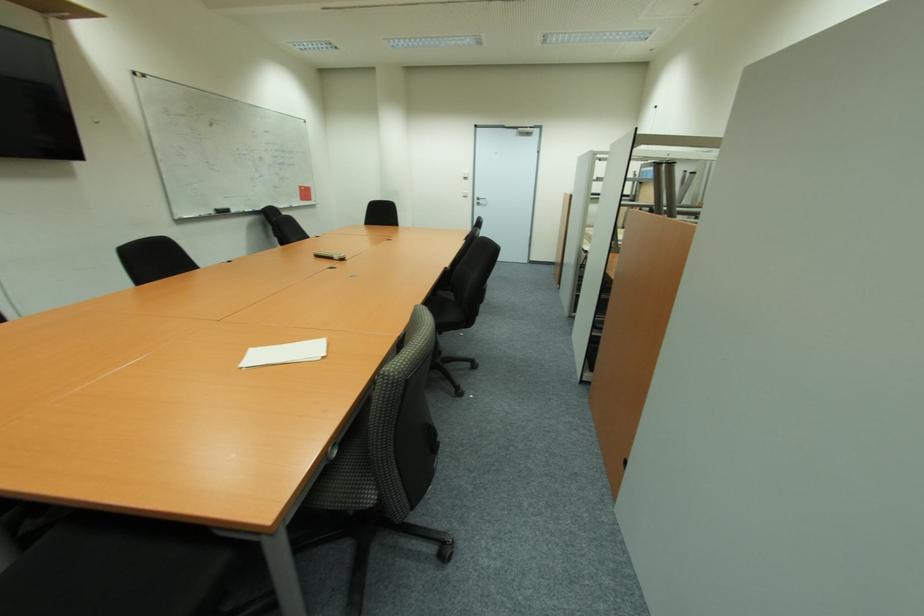
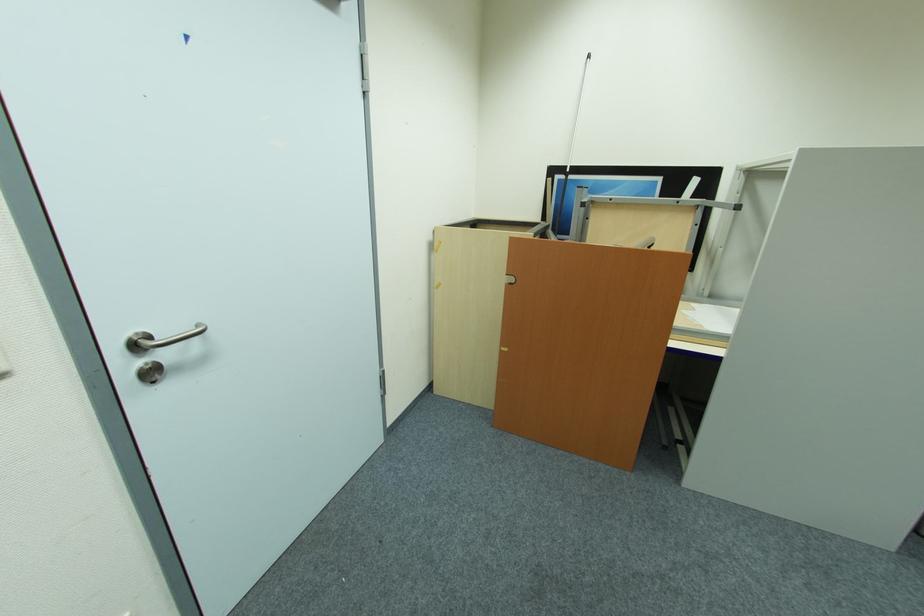
The point at (x=481, y=200) is marked in the first image. Where is the corresponding point in the second image?

(141, 347)